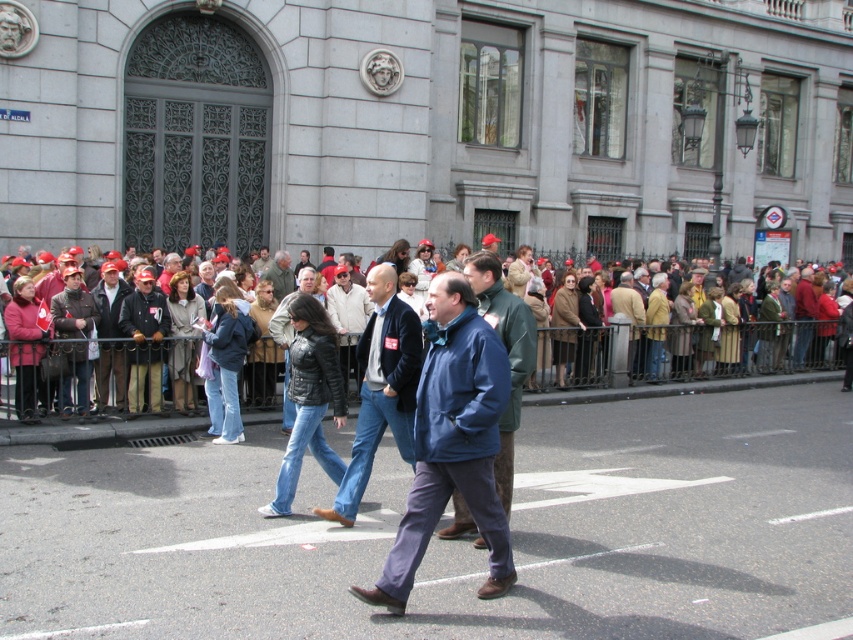
Which is in front, point (495, 264) or point (277, 260)?

Positioned in front is point (495, 264).

Which is in front, point (527, 321) or point (271, 278)?

Positioned in front is point (527, 321).

Find the location of `blue fabric jacket at center`. blue fabric jacket at center is located at coordinates (508, 355).

Consider the image. Between red fabric crowd at center and blue fabric jacket at center, which one has less height?

blue fabric jacket at center is shorter.

Is the position of red fabric crowd at center more distant than that of blue fabric jacket at center?

Yes, red fabric crowd at center is behind blue fabric jacket at center.

Between point (811, 355) and point (490, 253), which one is positioned behind?

The point (811, 355) is behind.

The height and width of the screenshot is (640, 853). In order to click on red fabric crowd at center in this screenshot , I will do `click(733, 346)`.

Can you confirm if blue fleece jacket at center is smaller than blue fabric jacket at center?

Incorrect, blue fleece jacket at center is not smaller in size than blue fabric jacket at center.

Locate an element on the screen. The height and width of the screenshot is (640, 853). blue fleece jacket at center is located at coordinates (451, 442).